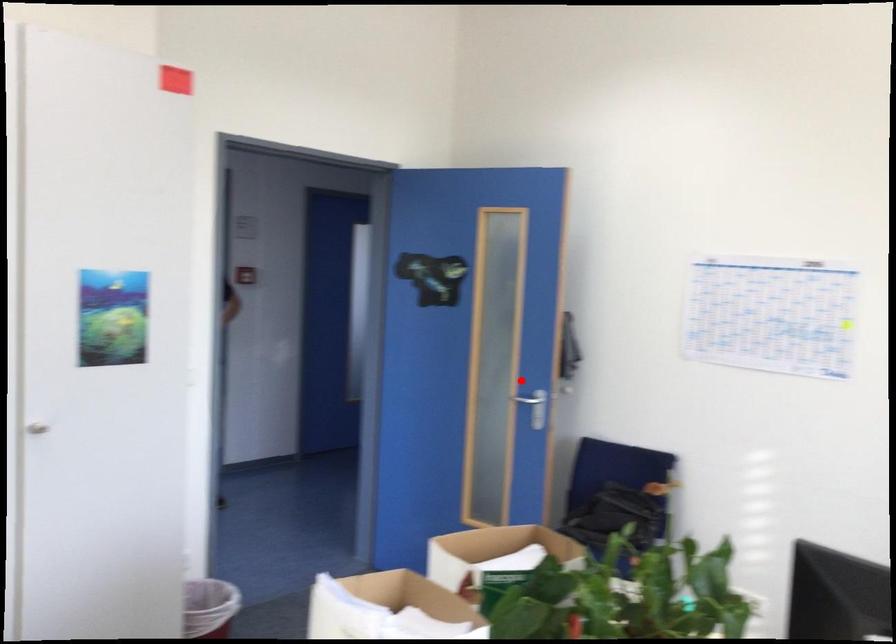
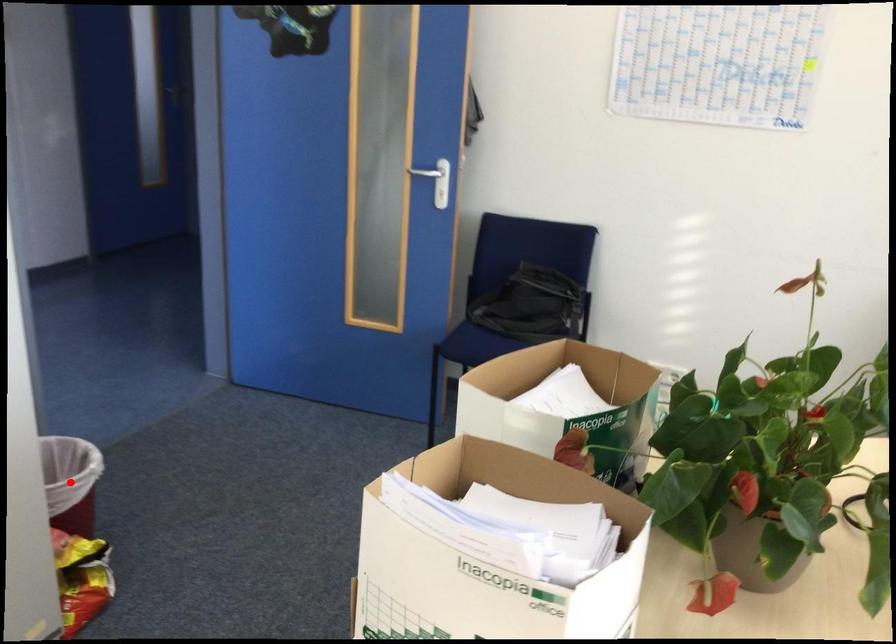
I am providing you with two images of the same scene from different viewpoints. A red point is marked on the first image and another point is marked on the second image. Does the point marked in image1 correspond to the same location as the one in image2?

No